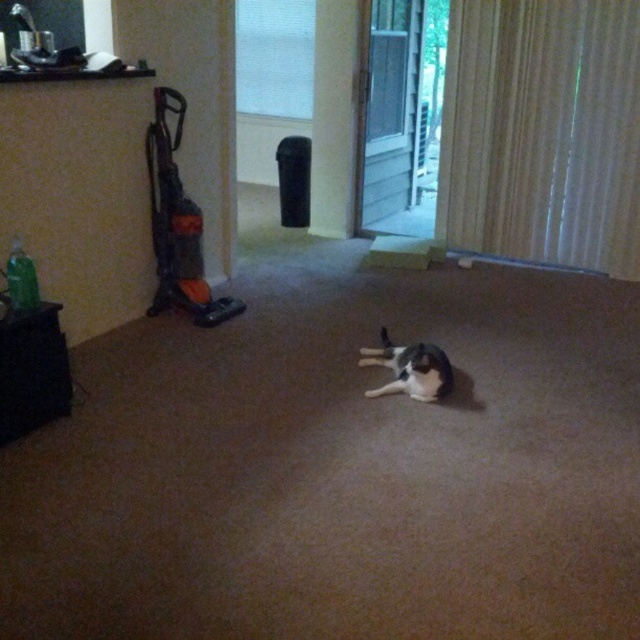
You are standing in the living room and want to exit through the front door. The transparent glass screen door at center is in your way. Can you move around it to reach the front door?

The transparent glass screen door at center is positioned at coordinates point [403,115], so you can move around it to reach the front door since it is not blocking the entire path.

You are a person standing at the orange plastic vacuum at left and want to reach the black and white cat in the center without moving the vacuum. Can you do it?

The distance between the orange plastic vacuum at left and the black and white cat in the center is 3.50 meters. Since you can walk around the vacuum, you can reach the cat by moving towards the center of the room.

You are trying to decide whether to place a new plant pot between the transparent glass screen door at center and the orange plastic vacuum at left. The plant pot is 1 meter wide. Can it fit between them?

The transparent glass screen door at center is larger in size than the orange plastic vacuum at left, but the exact distance between them isn t specified. Without knowing the actual spacing, it s impossible to determine if the 1 meter wide plant pot will fit.